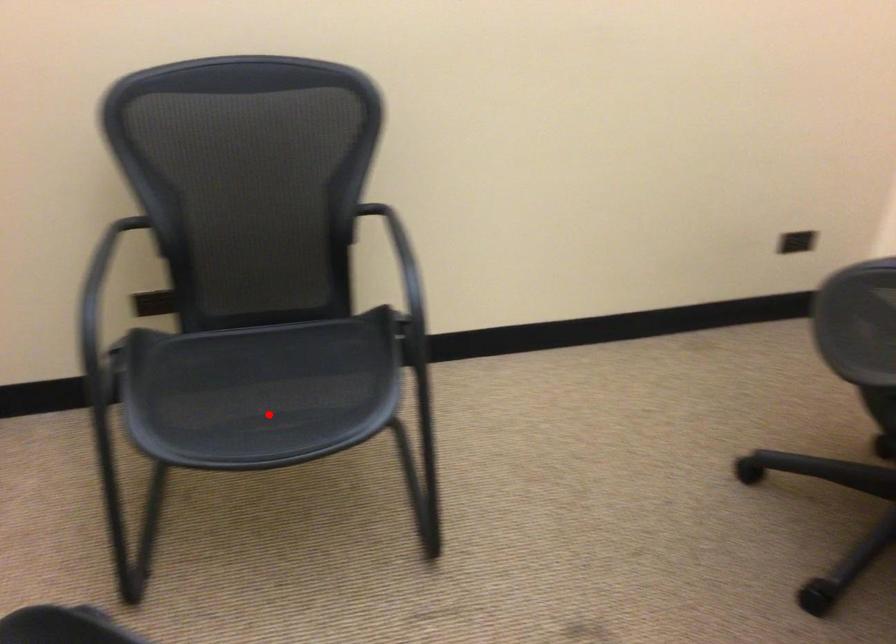
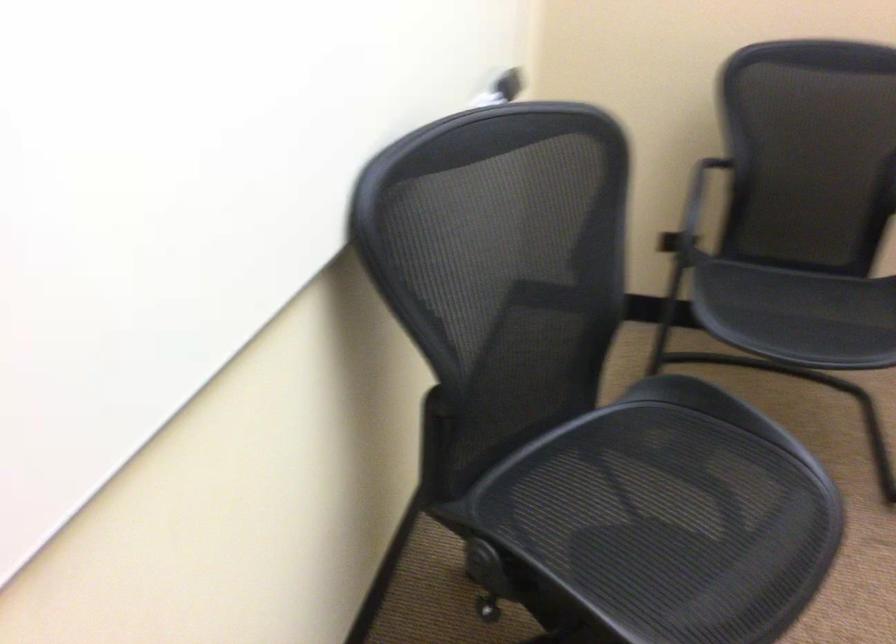
Question: I am providing you with two images of the same scene from different viewpoints. A red point is shown in image1. For the corresponding object point in image2, is it positioned nearer or farther from the camera?

Choices:
 (A) Nearer
 (B) Farther

Answer: (B)